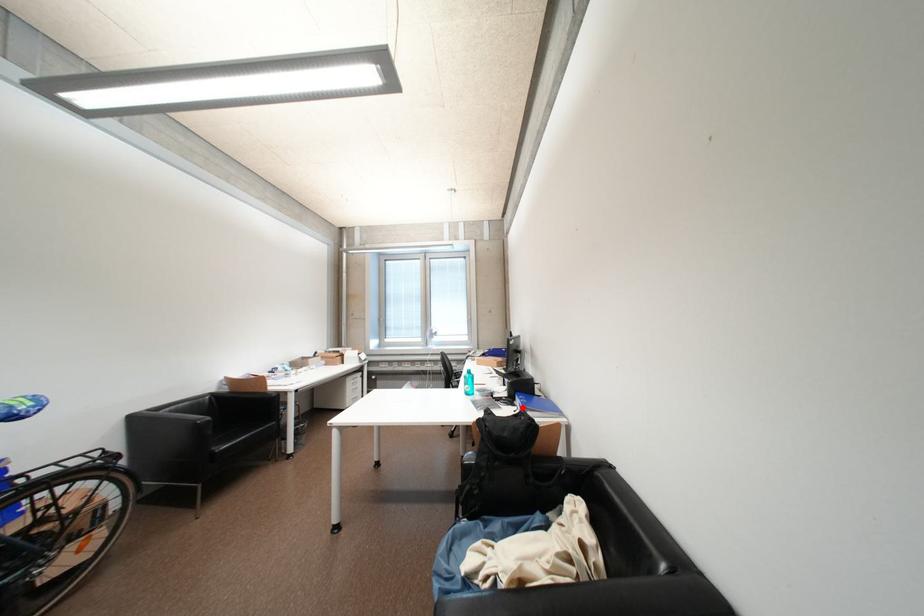
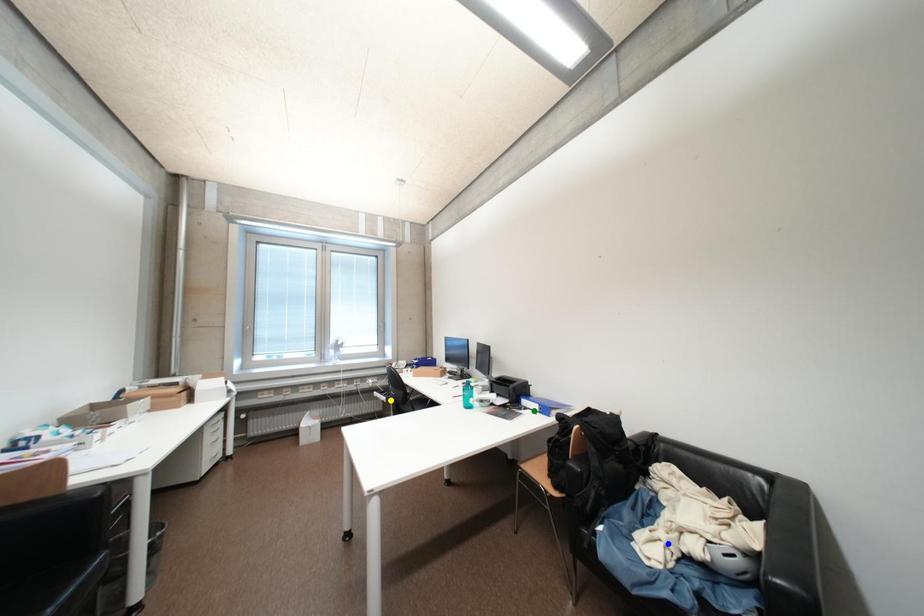
Question: I am providing you with two images of the same scene from different viewpoints. A red point is marked on the first image. You are given multiple points on the second image. In image 2, which mark is for the same physical point as the one in image 1?

Choices:
 (A) blue point
 (B) green point
 (C) yellow point

Answer: (B)